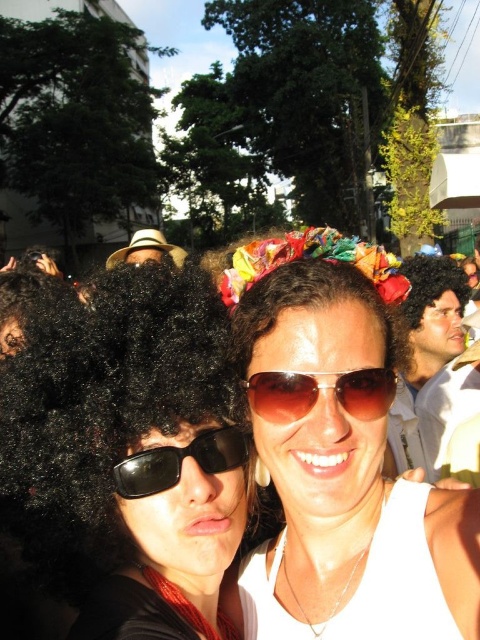
Question: Is matte white shirt at center below white straw hat at center?

Choices:
 (A) no
 (B) yes

Answer: (B)

Question: Does sunglasses at center have a greater width compared to matte white shirt at center?

Choices:
 (A) no
 (B) yes

Answer: (A)

Question: Which of the following is the farthest from the observer?

Choices:
 (A) (445, 272)
 (B) (112, 259)

Answer: (B)

Question: Which of the following is the farthest from the observer?

Choices:
 (A) (394, 604)
 (B) (143, 260)
 (C) (143, 452)

Answer: (B)

Question: Is brown reflective sunglasses at center closer to camera compared to black reflective sunglasses at left?

Choices:
 (A) no
 (B) yes

Answer: (A)

Question: Which point is closer to the camera taking this photo?

Choices:
 (A) (142, 234)
 (B) (450, 268)
 (C) (404, 563)

Answer: (C)